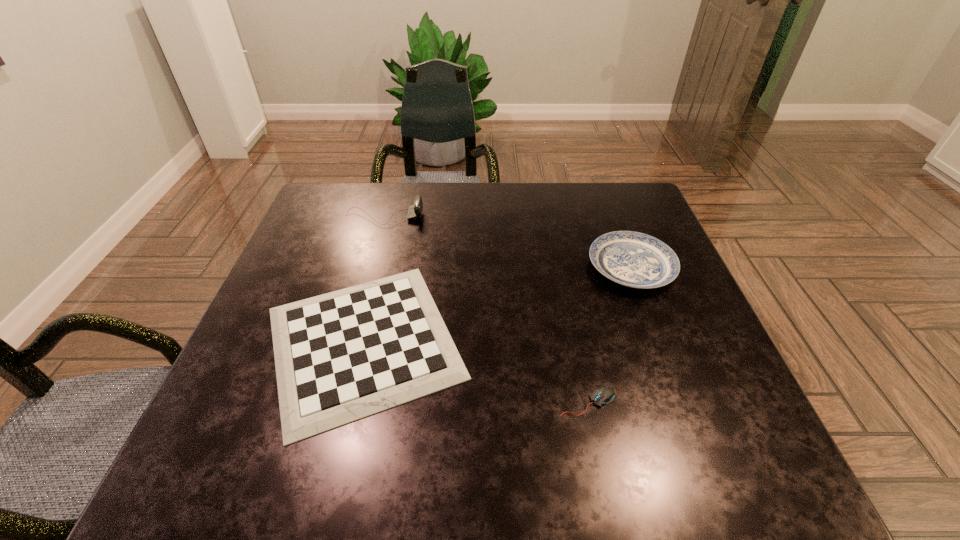
At what (x,y) coordinates should I click in order to perform the action: click on free region that satisfies the following two spatial constraints: 1. on the front-facing side of the second tallest object; 2. on the left side of the farthest object. Please return your answer as a coordinate pair (x, y). The height and width of the screenshot is (540, 960). Looking at the image, I should click on (371, 267).

Locate an element on the screen. The height and width of the screenshot is (540, 960). free space that satisfies the following two spatial constraints: 1. on the front-facing side of the farthest object; 2. on the back side of the mouse is located at coordinates (334, 402).

At what (x,y) coordinates should I click in order to perform the action: click on vacant position in the image that satisfies the following two spatial constraints: 1. on the front-facing side of the tallest object; 2. on the left side of the chessboard. Please return your answer as a coordinate pair (x, y). The image size is (960, 540). Looking at the image, I should click on click(x=350, y=342).

This screenshot has width=960, height=540. In order to click on blank space that satisfies the following two spatial constraints: 1. on the front-facing side of the webcam; 2. on the back side of the mouse in this screenshot , I will do point(334,402).

Where is `free region that satisfies the following two spatial constraints: 1. on the back side of the rightmost object; 2. on the front-facing side of the webcam`? free region that satisfies the following two spatial constraints: 1. on the back side of the rightmost object; 2. on the front-facing side of the webcam is located at coordinates (612, 217).

Locate an element on the screen. The width and height of the screenshot is (960, 540). free location that satisfies the following two spatial constraints: 1. on the front-facing side of the webcam; 2. on the right side of the plate is located at coordinates (371, 267).